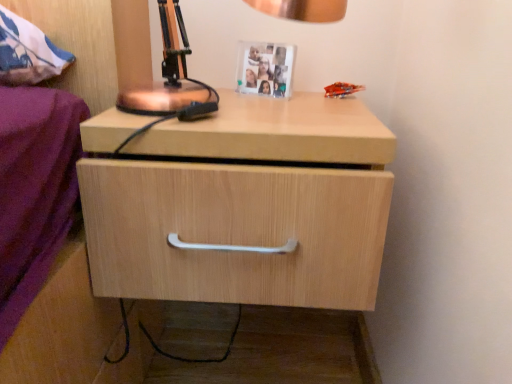
Question: Is light wood drawer at center looking in the opposite direction of copper metallic table lamp at upper center?

Choices:
 (A) no
 (B) yes

Answer: (A)

Question: Considering the relative sizes of light wood drawer at center and copper metallic table lamp at upper center in the image provided, is light wood drawer at center wider than copper metallic table lamp at upper center?

Choices:
 (A) yes
 (B) no

Answer: (A)

Question: Is light wood drawer at center at the right side of copper metallic table lamp at upper center?

Choices:
 (A) yes
 (B) no

Answer: (A)

Question: Considering the relative sizes of light wood drawer at center and copper metallic table lamp at upper center in the image provided, is light wood drawer at center thinner than copper metallic table lamp at upper center?

Choices:
 (A) no
 (B) yes

Answer: (A)

Question: Does light wood drawer at center appear on the left side of copper metallic table lamp at upper center?

Choices:
 (A) no
 (B) yes

Answer: (A)

Question: Are light wood drawer at center and copper metallic table lamp at upper center making contact?

Choices:
 (A) yes
 (B) no

Answer: (B)

Question: Is white plastic picture frame at upper center at the left side of light wood drawer at center?

Choices:
 (A) yes
 (B) no

Answer: (B)

Question: Is white plastic picture frame at upper center thinner than light wood drawer at center?

Choices:
 (A) yes
 (B) no

Answer: (A)

Question: Can you confirm if white plastic picture frame at upper center is shorter than light wood drawer at center?

Choices:
 (A) no
 (B) yes

Answer: (B)

Question: Does white plastic picture frame at upper center come in front of light wood drawer at center?

Choices:
 (A) yes
 (B) no

Answer: (B)

Question: Is white plastic picture frame at upper center smaller than light wood drawer at center?

Choices:
 (A) no
 (B) yes

Answer: (B)

Question: Is light wood drawer at center inside white plastic picture frame at upper center?

Choices:
 (A) yes
 (B) no

Answer: (B)

Question: From a real-world perspective, is copper metallic table lamp at upper center on top of white plastic picture frame at upper center?

Choices:
 (A) yes
 (B) no

Answer: (A)